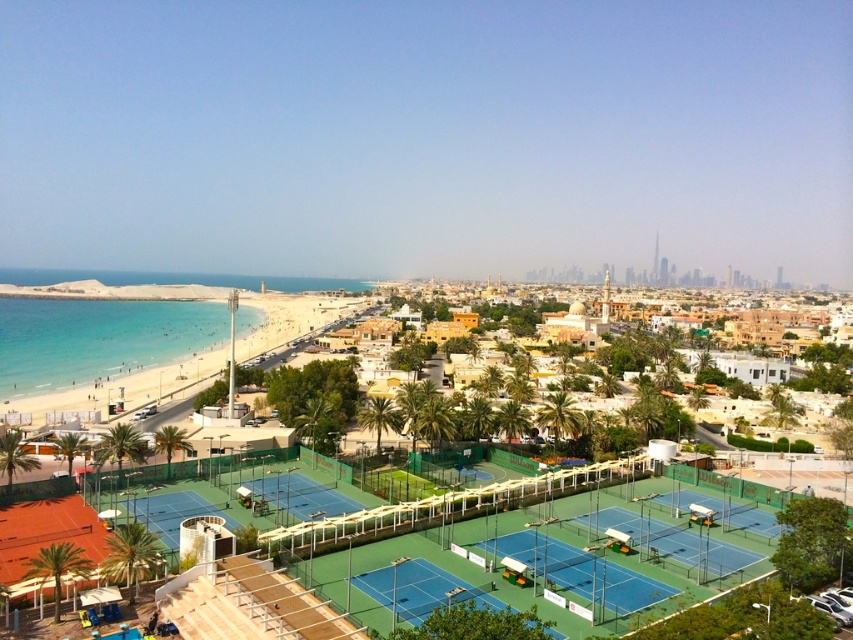
Is point (283, 547) positioned after point (540, 474)?

No, (283, 547) is closer to viewer.

Image resolution: width=853 pixels, height=640 pixels. What do you see at coordinates (410, 520) in the screenshot?
I see `green synthetic turf tennis courts at center` at bounding box center [410, 520].

Which is behind, point (706, 548) or point (546, 497)?

The point (546, 497) is behind.

Find the location of a particular element. This screenshot has width=853, height=640. green synthetic turf tennis courts at center is located at coordinates (410, 520).

Can you confirm if smooth sand beach at lower left is thinner than green synthetic turf tennis courts at center?

Incorrect, smooth sand beach at lower left's width is not less than green synthetic turf tennis courts at center's.

Looking at this image, does smooth sand beach at lower left have a greater width compared to green synthetic turf tennis courts at center?

Correct, the width of smooth sand beach at lower left exceeds that of green synthetic turf tennis courts at center.

Which is in front, point (15, 298) or point (300, 552)?

Positioned in front is point (300, 552).

Locate an element on the screen. smooth sand beach at lower left is located at coordinates (107, 348).

In the scene shown: Who is positioned more to the right, smooth sand beach at lower left or green synthetic turf tennis court at lower left?

From the viewer's perspective, green synthetic turf tennis court at lower left appears more on the right side.

Can you confirm if smooth sand beach at lower left is positioned to the right of green synthetic turf tennis court at lower left?

In fact, smooth sand beach at lower left is to the left of green synthetic turf tennis court at lower left.

You are a GUI agent. You are given a task and a screenshot of the screen. Output one action in this format:
    pyautogui.click(x=<x>, y=<y>)
    Task: Click on the smooth sand beach at lower left
    This screenshot has width=853, height=640.
    Given the screenshot: What is the action you would take?
    pyautogui.click(x=107, y=348)